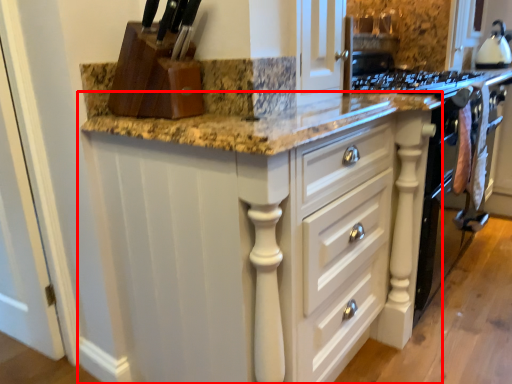
Question: Observing the image, what is the correct spatial positioning of cabinetry (annotated by the red box) in reference to kitchen appliance?

Choices:
 (A) left
 (B) right

Answer: (A)